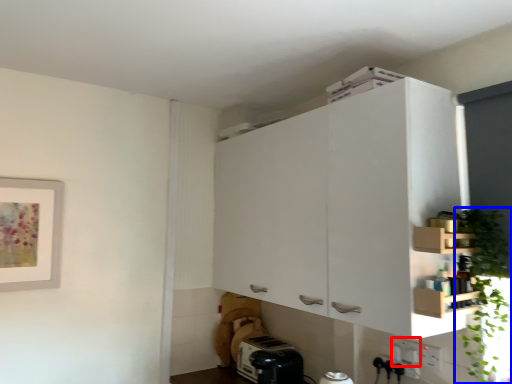
Question: Which object appears farthest to the camera in this image, electric outlet (highlighted by a red box) or plant (highlighted by a blue box)?

Choices:
 (A) electric outlet
 (B) plant

Answer: (A)